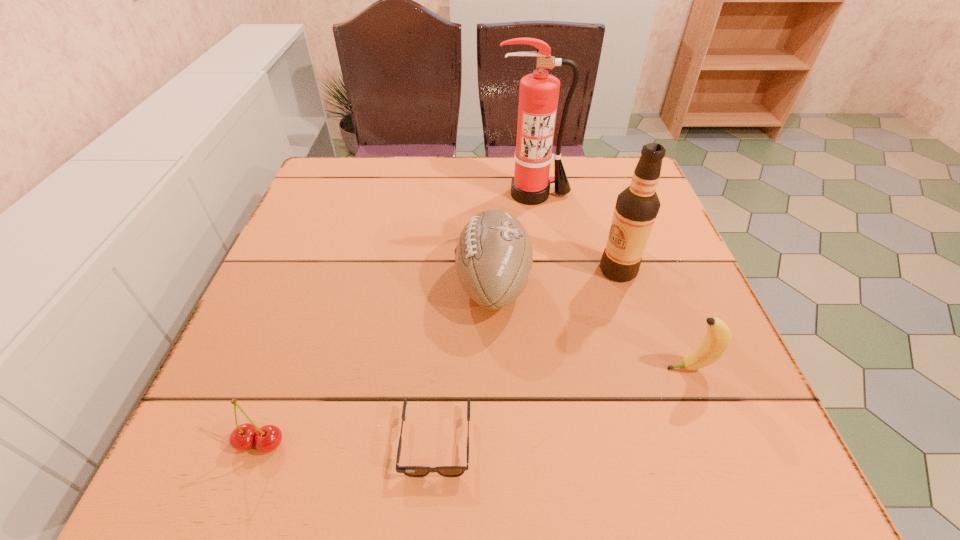
This screenshot has height=540, width=960. Identify the location of the fifth closest object to the cherry. 538,96.

This screenshot has width=960, height=540. Identify the location of vacant position in the image that satisfies the following two spatial constraints: 1. from the stem of the third nearest object; 2. on the temples of the sunglasses. (718, 442).

Find the location of a particular element. The image size is (960, 540). free spot that satisfies the following two spatial constraints: 1. on the laces of the football (American); 2. with the stems of the leftmost object pointing upwards is located at coordinates (497, 443).

Where is `vacant space that satisfies the following two spatial constraints: 1. on the label of the alcohol; 2. with the stems of the cherry pointing upwards`? The image size is (960, 540). vacant space that satisfies the following two spatial constraints: 1. on the label of the alcohol; 2. with the stems of the cherry pointing upwards is located at coordinates (673, 443).